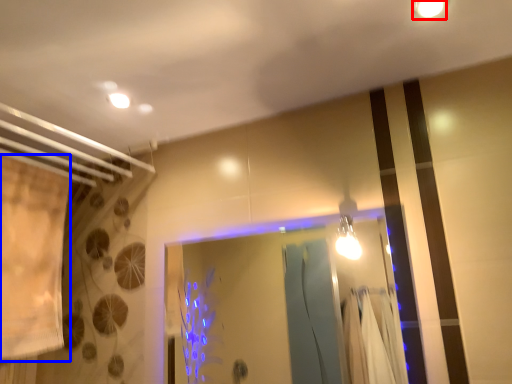
Question: Which of the following is the farthest to the observer, light fixture (highlighted by a red box) or shower curtain (highlighted by a blue box)?

Choices:
 (A) light fixture
 (B) shower curtain

Answer: (B)